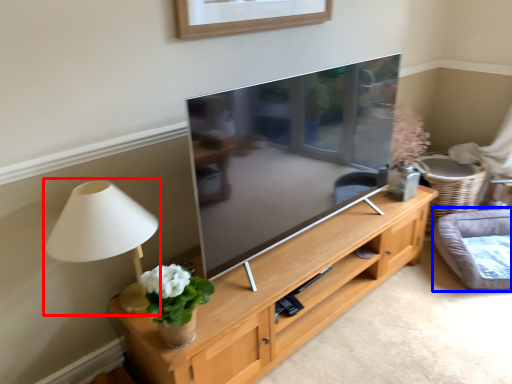
Question: Which object is further to the camera taking this photo, table lamp (highlighted by a red box) or cat bed (highlighted by a blue box)?

Choices:
 (A) table lamp
 (B) cat bed

Answer: (B)